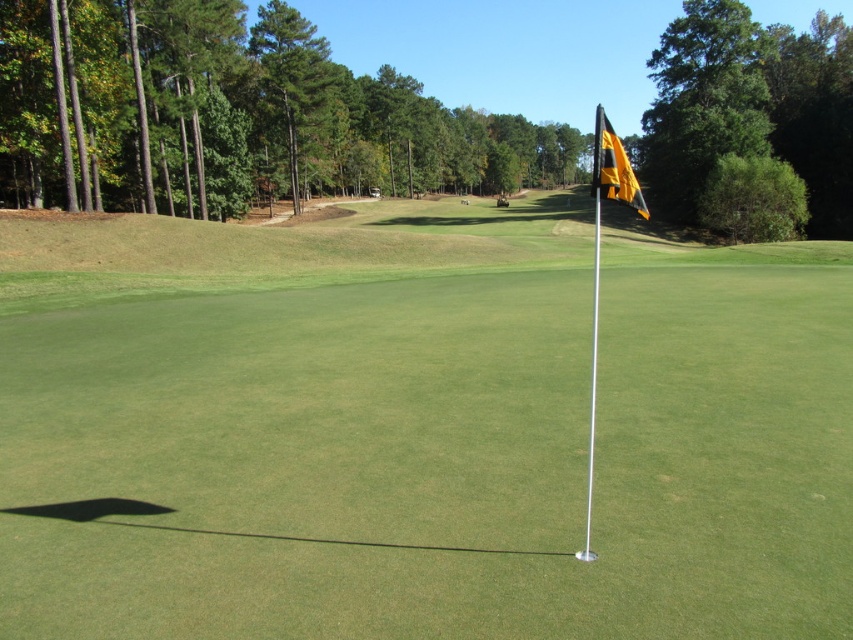
Question: Is metallic flag at center behind black/yellow fabric flag at upper right?

Choices:
 (A) no
 (B) yes

Answer: (A)

Question: Does metallic flag at center have a larger size compared to black/yellow fabric flag at upper right?

Choices:
 (A) no
 (B) yes

Answer: (B)

Question: Does metallic flag at center have a lesser width compared to black/yellow fabric flag at upper right?

Choices:
 (A) no
 (B) yes

Answer: (A)

Question: Which of the following is the farthest from the observer?

Choices:
 (A) metallic flag at center
 (B) black/yellow fabric flag at upper right

Answer: (B)